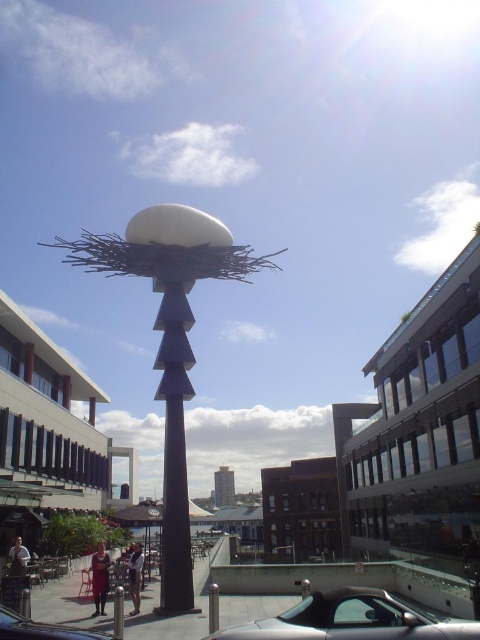
Measure the distance from shiny silver car at lower center to shiny black car at lower left.

shiny silver car at lower center is 13.18 feet away from shiny black car at lower left.

Does shiny silver car at lower center have a greater height compared to shiny black car at lower left?

Correct, shiny silver car at lower center is much taller as shiny black car at lower left.

Between point (464, 621) and point (48, 637), which one is positioned behind?

Positioned behind is point (464, 621).

The height and width of the screenshot is (640, 480). Identify the location of shiny silver car at lower center. (351, 620).

Describe the element at coordinates (175, 448) in the screenshot. This screenshot has height=640, width=480. I see `black polished stone pole at center` at that location.

Does black polished stone pole at center have a lesser height compared to shiny black car at lower left?

In fact, black polished stone pole at center may be taller than shiny black car at lower left.

Which is behind, point (163, 572) or point (15, 625)?

The point (163, 572) is behind.

The height and width of the screenshot is (640, 480). Identify the location of black polished stone pole at center. (175, 448).

From the picture: Is black polished stone pole at center thinner than shiny silver car at lower center?

No, black polished stone pole at center is not thinner than shiny silver car at lower center.

Does black polished stone pole at center have a larger size compared to shiny silver car at lower center?

Correct, black polished stone pole at center is larger in size than shiny silver car at lower center.

Identify the location of black polished stone pole at center. (175, 448).

You are a GUI agent. You are given a task and a screenshot of the screen. Output one action in this format:
    pyautogui.click(x=<x>, y=<y>)
    Task: Click on the black polished stone pole at center
    
    Given the screenshot: What is the action you would take?
    pyautogui.click(x=175, y=448)